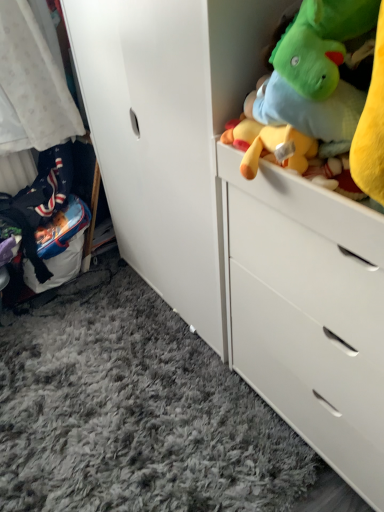
Question: Is white soft fabric at left smaller than soft plush toys at upper right?

Choices:
 (A) no
 (B) yes

Answer: (B)

Question: Are white soft fabric at left and soft plush toys at upper right making contact?

Choices:
 (A) yes
 (B) no

Answer: (B)

Question: Would you consider white soft fabric at left to be distant from soft plush toys at upper right?

Choices:
 (A) yes
 (B) no

Answer: (A)

Question: From a real-world perspective, is white soft fabric at left below soft plush toys at upper right?

Choices:
 (A) yes
 (B) no

Answer: (A)

Question: Is white soft fabric at left further to camera compared to soft plush toys at upper right?

Choices:
 (A) yes
 (B) no

Answer: (A)

Question: From the image's perspective, does white soft fabric at left appear higher than soft plush toys at upper right?

Choices:
 (A) yes
 (B) no

Answer: (A)

Question: From a real-world perspective, is white matte chest of drawers at upper right located beneath soft plush toys at upper right?

Choices:
 (A) yes
 (B) no

Answer: (A)

Question: Is white matte chest of drawers at upper right wider than soft plush toys at upper right?

Choices:
 (A) no
 (B) yes

Answer: (B)

Question: Is white matte chest of drawers at upper right further to camera compared to soft plush toys at upper right?

Choices:
 (A) no
 (B) yes

Answer: (B)

Question: From the image's perspective, is white matte chest of drawers at upper right located above soft plush toys at upper right?

Choices:
 (A) yes
 (B) no

Answer: (B)

Question: From a real-world perspective, is white matte chest of drawers at upper right positioned over soft plush toys at upper right based on gravity?

Choices:
 (A) no
 (B) yes

Answer: (A)

Question: Is white matte chest of drawers at upper right closer to the viewer compared to soft plush toys at upper right?

Choices:
 (A) yes
 (B) no

Answer: (B)

Question: Could you tell me if white soft fabric at left is facing white matte chest of drawers at upper right?

Choices:
 (A) no
 (B) yes

Answer: (B)